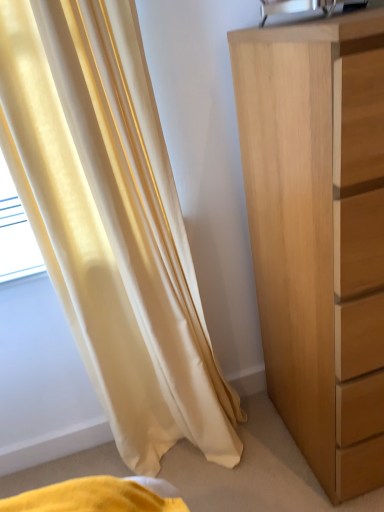
The width and height of the screenshot is (384, 512). Describe the element at coordinates (112, 223) in the screenshot. I see `satin yellow curtain at left` at that location.

Find the location of a particular element. satin yellow curtain at left is located at coordinates (112, 223).

This screenshot has width=384, height=512. I want to click on light brown wood chest of drawers at right, so click(x=314, y=239).

The width and height of the screenshot is (384, 512). What do you see at coordinates (314, 239) in the screenshot?
I see `light brown wood chest of drawers at right` at bounding box center [314, 239].

Where is `satin yellow curtain at left`? The height and width of the screenshot is (512, 384). satin yellow curtain at left is located at coordinates (112, 223).

Which is more to the left, satin yellow curtain at left or light brown wood chest of drawers at right?

satin yellow curtain at left is more to the left.

Is the depth of satin yellow curtain at left greater than that of light brown wood chest of drawers at right?

That is True.

In the scene shown: Which is nearer, (78,99) or (372,87)?

Point (78,99).

Based on the photo, from the image's perspective, is satin yellow curtain at left on top of light brown wood chest of drawers at right?

Incorrect, from the image's perspective, satin yellow curtain at left is lower than light brown wood chest of drawers at right.

From a real-world perspective, is satin yellow curtain at left located beneath light brown wood chest of drawers at right?

No, from a real-world perspective, satin yellow curtain at left is not beneath light brown wood chest of drawers at right.

Is satin yellow curtain at left wider than light brown wood chest of drawers at right?

In fact, satin yellow curtain at left might be narrower than light brown wood chest of drawers at right.

Can you confirm if satin yellow curtain at left is shorter than light brown wood chest of drawers at right?

No, satin yellow curtain at left is not shorter than light brown wood chest of drawers at right.

In the scene shown: Is satin yellow curtain at left smaller than light brown wood chest of drawers at right?

Yes, satin yellow curtain at left is smaller than light brown wood chest of drawers at right.

Is satin yellow curtain at left not within light brown wood chest of drawers at right?

satin yellow curtain at left is positioned outside light brown wood chest of drawers at right.

Is there a large distance between satin yellow curtain at left and light brown wood chest of drawers at right?

satin yellow curtain at left is actually quite close to light brown wood chest of drawers at right.

Based on the photo, is satin yellow curtain at left aimed at light brown wood chest of drawers at right?

No.

Can you tell me how much satin yellow curtain at left and light brown wood chest of drawers at right differ in facing direction?

There is a 0.000435-degree angle between the facing directions of satin yellow curtain at left and light brown wood chest of drawers at right.

How far apart are satin yellow curtain at left and light brown wood chest of drawers at right?

A distance of 37.57 centimeters exists between satin yellow curtain at left and light brown wood chest of drawers at right.

This screenshot has width=384, height=512. I want to click on chest of drawers located on the right of satin yellow curtain at left, so click(314, 239).

Which is more to the right, light brown wood chest of drawers at right or satin yellow curtain at left?

Positioned to the right is light brown wood chest of drawers at right.

Which is behind, light brown wood chest of drawers at right or satin yellow curtain at left?

Positioned behind is satin yellow curtain at left.

Is point (284, 167) closer or farther from the camera than point (209, 437)?

Point (284, 167) appears to be closer to the viewer than point (209, 437).

From the image's perspective, is light brown wood chest of drawers at right located above or below satin yellow curtain at left?

light brown wood chest of drawers at right is above satin yellow curtain at left.

From a real-world perspective, is light brown wood chest of drawers at right beneath satin yellow curtain at left?

Yes, from a real-world perspective, light brown wood chest of drawers at right is under satin yellow curtain at left.

Is light brown wood chest of drawers at right wider or thinner than satin yellow curtain at left?

Clearly, light brown wood chest of drawers at right has more width compared to satin yellow curtain at left.

Does light brown wood chest of drawers at right have a greater height compared to satin yellow curtain at left?

Incorrect, the height of light brown wood chest of drawers at right is not larger of that of satin yellow curtain at left.

Is light brown wood chest of drawers at right bigger or smaller than satin yellow curtain at left?

Considering their sizes, light brown wood chest of drawers at right takes up more space than satin yellow curtain at left.

Is satin yellow curtain at left completely or partially inside light brown wood chest of drawers at right?

Definitely not — satin yellow curtain at left is not inside light brown wood chest of drawers at right.

Are light brown wood chest of drawers at right and satin yellow curtain at left located far from each other?

Actually, light brown wood chest of drawers at right and satin yellow curtain at left are a little close together.

Could you tell me if light brown wood chest of drawers at right is turned towards satin yellow curtain at left?

No, light brown wood chest of drawers at right is not oriented towards satin yellow curtain at left.

How many degrees apart are the facing directions of light brown wood chest of drawers at right and satin yellow curtain at left?

0.000435 degrees separate the facing orientations of light brown wood chest of drawers at right and satin yellow curtain at left.

The width and height of the screenshot is (384, 512). Find the location of `the chest of drawers located above the satin yellow curtain at left (from the image's perspective)`. the chest of drawers located above the satin yellow curtain at left (from the image's perspective) is located at coordinates (314, 239).

The image size is (384, 512). Find the location of `chest of drawers in front of the satin yellow curtain at left`. chest of drawers in front of the satin yellow curtain at left is located at coordinates (314, 239).

Locate an element on the screen. This screenshot has height=512, width=384. curtain below the light brown wood chest of drawers at right (from the image's perspective) is located at coordinates (112, 223).